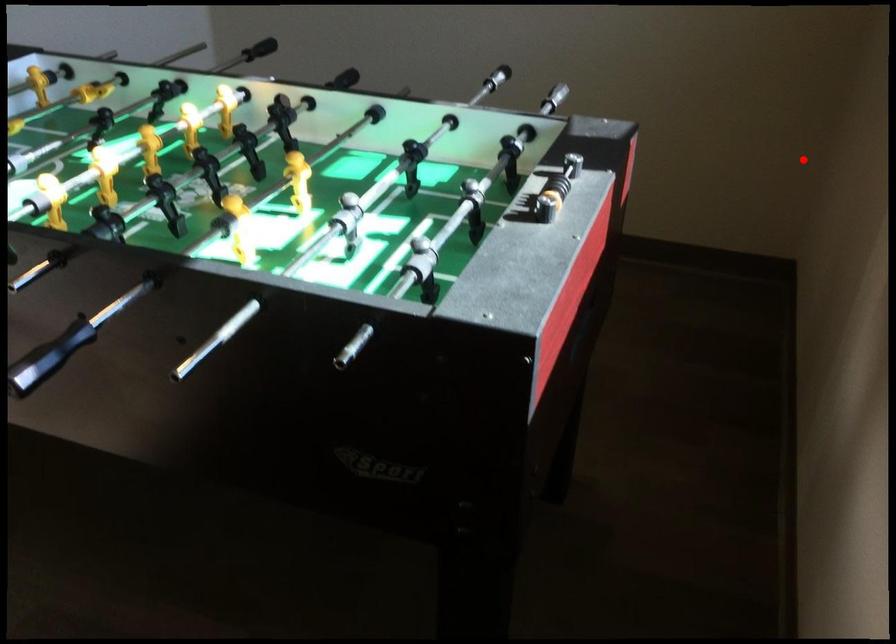
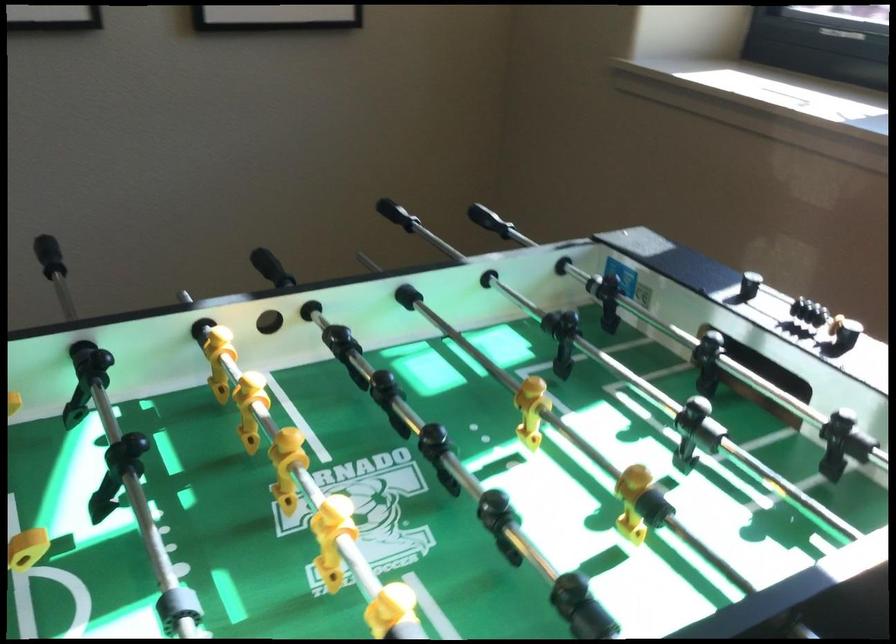
Locate, in the second image, the point that corresponds to the highlighted location in the first image.

(488, 220)